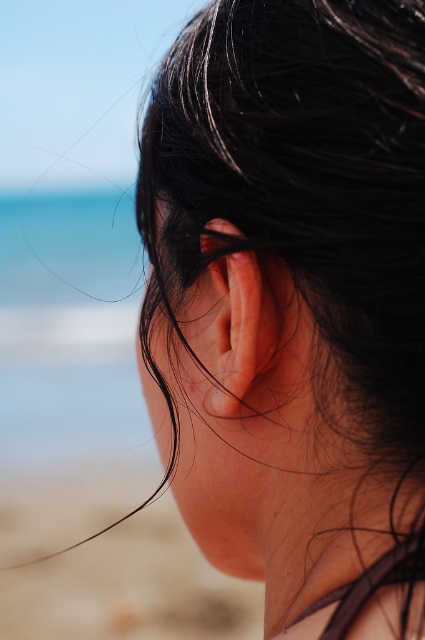
You are a photographer adjusting your camera focus. You need to focus on two points in the image, point (325,108) and point (172,548). Which point should you focus on first to ensure the closer one is sharp?

Point (325,108) is closer to the viewer than point (172,548), so you should focus on point (325,108) first to ensure the closer one is sharp.

You are a photographer trying to capture the black shiny hair at center and the beige sand at lower left in a single frame. Which object will appear narrower in your photo?

The black shiny hair at center is thinner than the beige sand at lower left, so it will appear narrower in the photo.